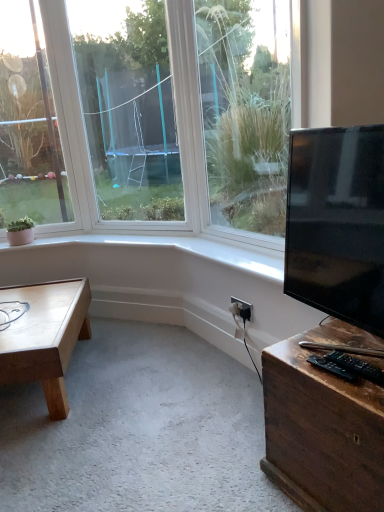
The image size is (384, 512). Find the location of `vacant point to the left of black plastic remote control at lower right, positioned as the 2th wide in left-to-right order`. vacant point to the left of black plastic remote control at lower right, positioned as the 2th wide in left-to-right order is located at coordinates (304, 369).